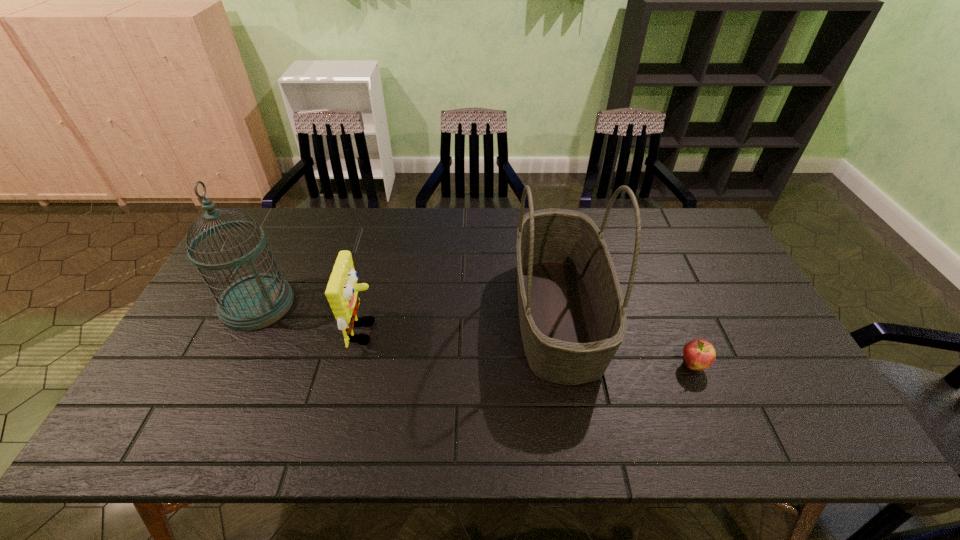
This screenshot has height=540, width=960. Identify the location of basket. (572, 315).

Locate an element on the screen. The width and height of the screenshot is (960, 540). birdcage is located at coordinates (256, 301).

What are the coordinates of `sponge` in the screenshot? It's located at (342, 289).

Where is `the second shortest object`? the second shortest object is located at coordinates (342, 289).

At what (x,y) coordinates should I click in order to perform the action: click on apple. Please return your answer as a coordinate pair (x, y). Looking at the image, I should click on (699, 354).

In order to click on the rightmost object in this screenshot , I will do `click(699, 354)`.

Locate an element on the screen. The height and width of the screenshot is (540, 960). vacant space located on the right of the third object from left to right is located at coordinates (645, 314).

Locate an element on the screen. Image resolution: width=960 pixels, height=540 pixels. blank area located 0.320m on the front-facing side of the leftmost object is located at coordinates (403, 304).

Identify the location of free spot located on the face of the sponge. The width and height of the screenshot is (960, 540). (516, 332).

Where is `vacant space located 0.270m on the back of the shortest object`? This screenshot has height=540, width=960. vacant space located 0.270m on the back of the shortest object is located at coordinates (658, 281).